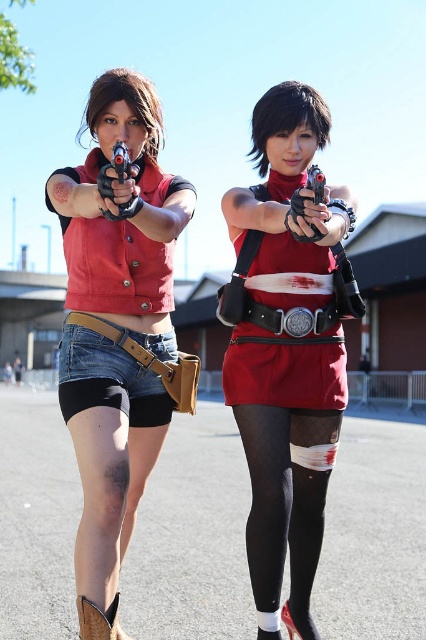
Between black mesh tights at lower center and brown leather boot at lower left, which one appears on the right side from the viewer's perspective?

black mesh tights at lower center is more to the right.

Is the position of black mesh tights at lower center more distant than that of brown leather boot at lower left?

Yes.

Is point (307, 436) positioned before point (103, 636)?

No, (307, 436) is behind (103, 636).

Where is `black mesh tights at lower center`? black mesh tights at lower center is located at coordinates (285, 506).

Is black plastic toy gun at upper center to the left of matte black toy gun at center from the viewer's perspective?

Indeed, black plastic toy gun at upper center is positioned on the left side of matte black toy gun at center.

Between point (120, 179) and point (313, 186), which one is positioned in front?

Positioned in front is point (120, 179).

This screenshot has height=640, width=426. What are the coordinates of `black plastic toy gun at upper center` in the screenshot? It's located at (115, 172).

Does matte black vest at center have a lesser width compared to matte black toy gun at center?

Result: No.

The height and width of the screenshot is (640, 426). Identify the location of matte black vest at center. (117, 321).

Between point (120, 288) and point (314, 241), which one is positioned behind?

Positioned behind is point (120, 288).

Identify the location of matte black vest at center. The width and height of the screenshot is (426, 640). (117, 321).